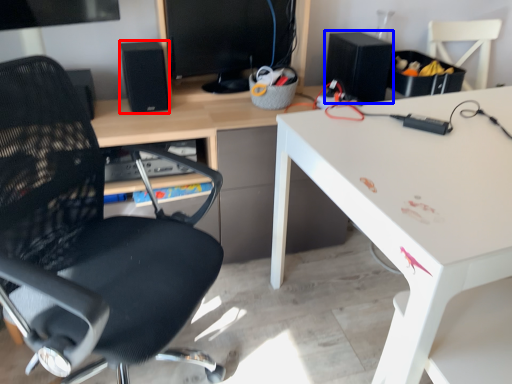
Question: Which object is closer to the camera taking this photo, speaker (highlighted by a red box) or speaker (highlighted by a blue box)?

Choices:
 (A) speaker
 (B) speaker

Answer: (A)